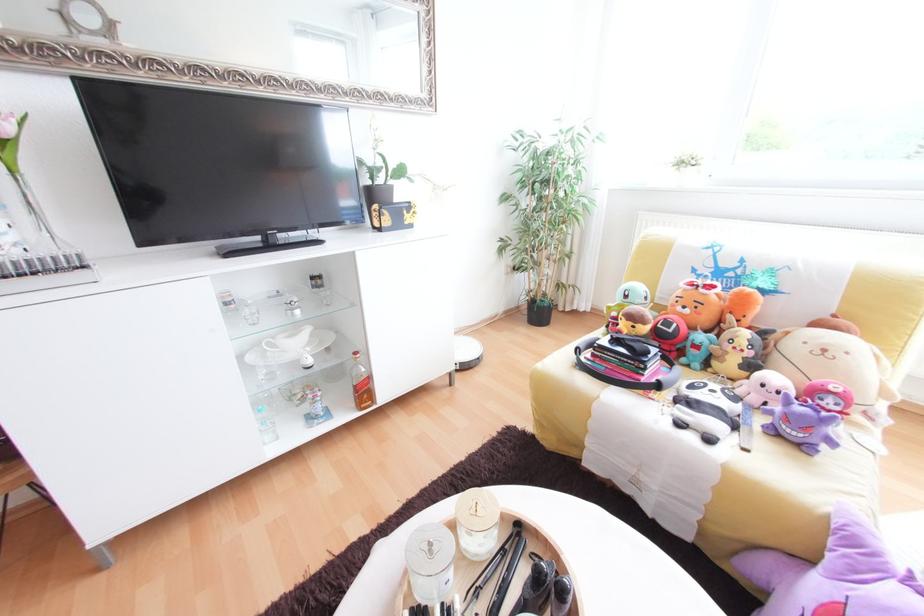
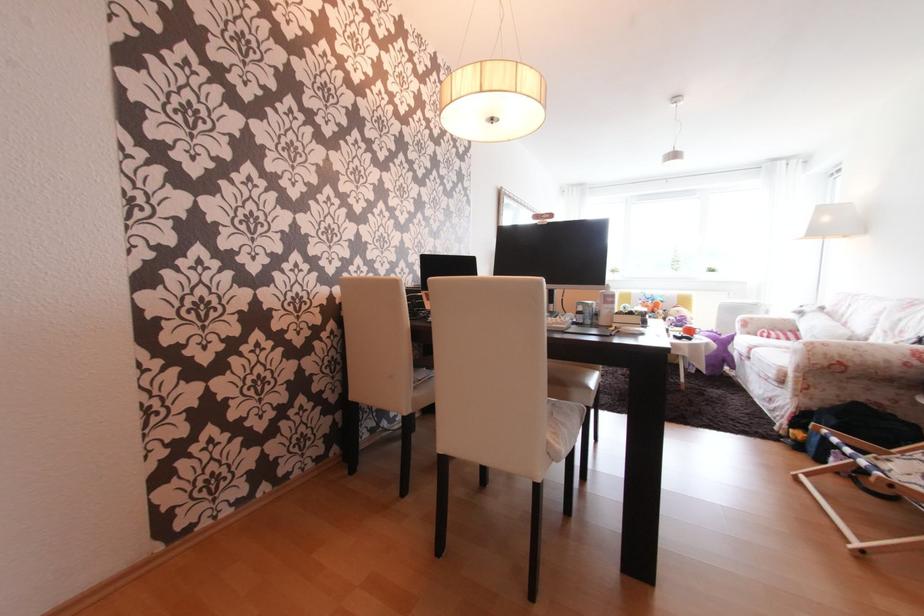
Which direction would the cameraman need to move to produce the second image?

The cameraman walked toward left, backward.